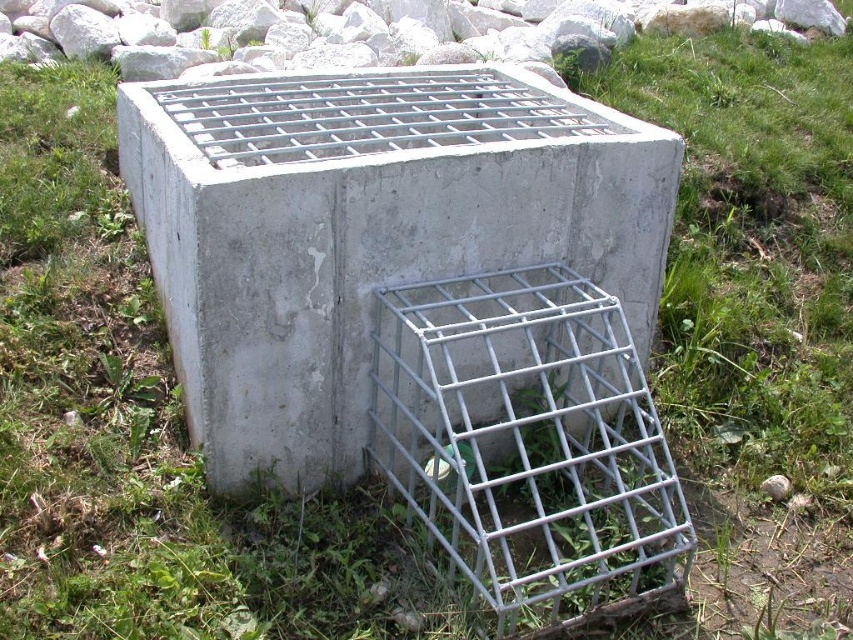
Measure the distance from gray concrete block at center to galvanized metal bird cage at center.

The distance of gray concrete block at center from galvanized metal bird cage at center is 18.18 inches.

Is point (558, 154) farther from viewer compared to point (448, 472)?

That is False.

Where is `gray concrete block at center`? gray concrete block at center is located at coordinates (364, 230).